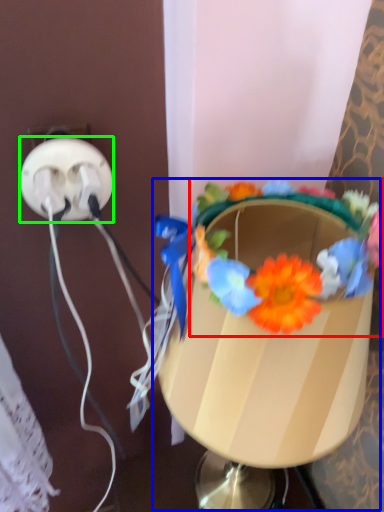
Question: Which object is the farthest from flower (highlighted by a red box)? Choose among these: table lamp (highlighted by a blue box) or power plugs and sockets (highlighted by a green box).

Choices:
 (A) table lamp
 (B) power plugs and sockets

Answer: (B)